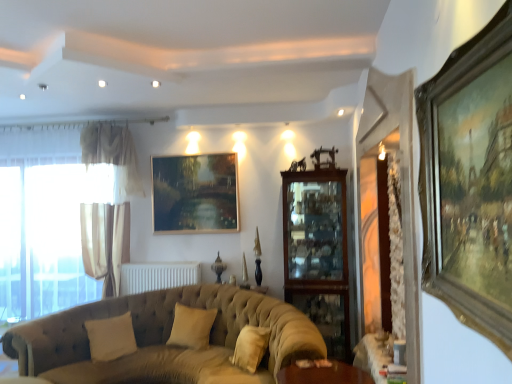
In order to click on empty space that is ontop of oil painting at center, arranged as the 1th picture frame when viewed from the left (from a real-world perspective) in this screenshot , I will do [196, 153].